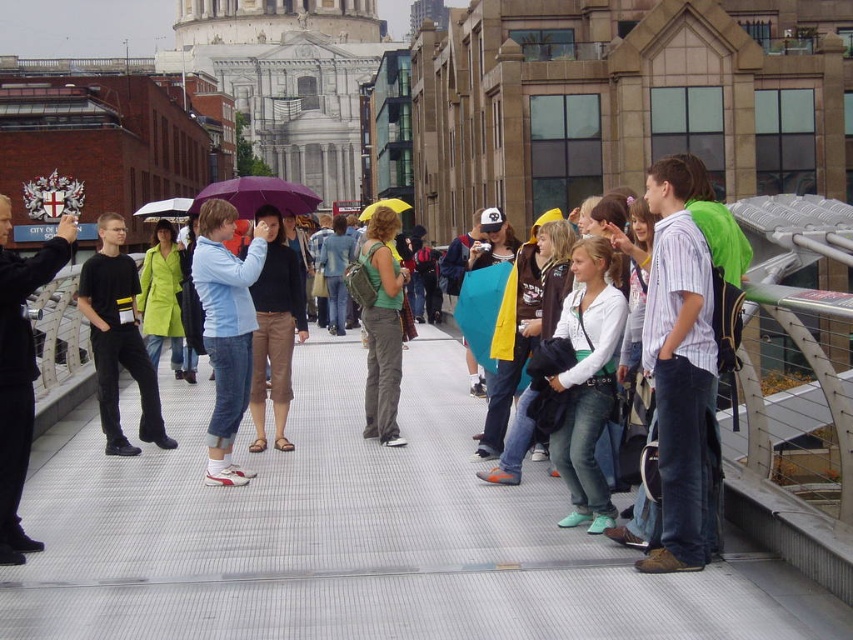
Question: Does green fabric backpack at center have a greater width compared to purple matte umbrella at center?

Choices:
 (A) yes
 (B) no

Answer: (B)

Question: Estimate the real-world distances between objects in this image. Which object is closer to the black matte shirt at left?

Choices:
 (A) green fabric backpack at center
 (B) black cotton shirt at left

Answer: (B)

Question: Is gray textured pavement at center thinner than light blue denim jeans at center?

Choices:
 (A) no
 (B) yes

Answer: (A)

Question: Estimate the real-world distances between objects in this image. Which object is farther from the purple matte umbrella at center?

Choices:
 (A) light blue denim jeans at center
 (B) black matte shirt at left

Answer: (B)

Question: In this image, where is gray textured pavement at center located relative to transparent plastic umbrella at center?

Choices:
 (A) right
 (B) left

Answer: (A)

Question: Which object is the farthest from the green matte coat at center?

Choices:
 (A) green fabric backpack at center
 (B) gray textured pavement at center
 (C) yellow fabric umbrella at center
 (D) black matte shirt at left

Answer: (C)